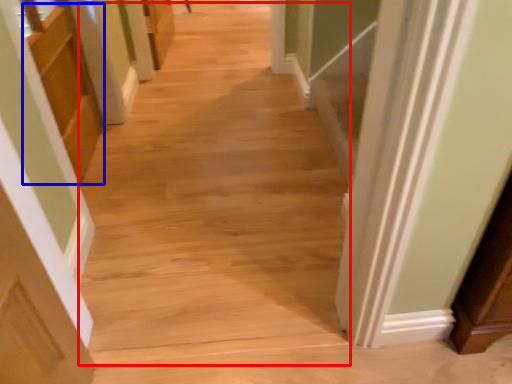
Question: Among these objects, which one is farthest to the camera, aisle (highlighted by a red box) or cabinetry (highlighted by a blue box)?

Choices:
 (A) aisle
 (B) cabinetry

Answer: (B)